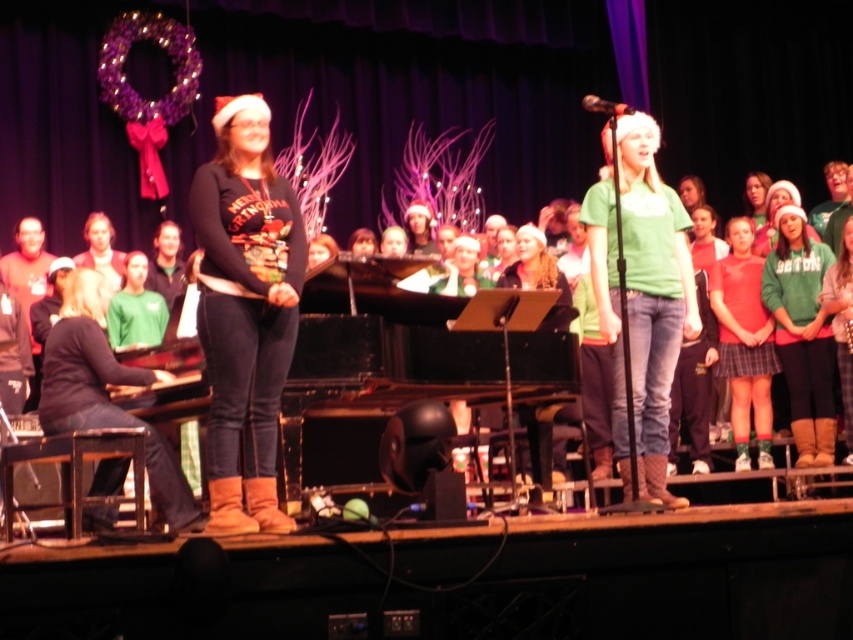
Between point (268, 212) and point (628, 230), which one is positioned in front?

Positioned in front is point (268, 212).

The height and width of the screenshot is (640, 853). Identify the location of matte black sweater at center. (245, 310).

Between point (216, 346) and point (618, 307), which one is positioned in front?

Point (216, 346) is in front.

In order to click on matte black sweater at center in this screenshot , I will do `click(245, 310)`.